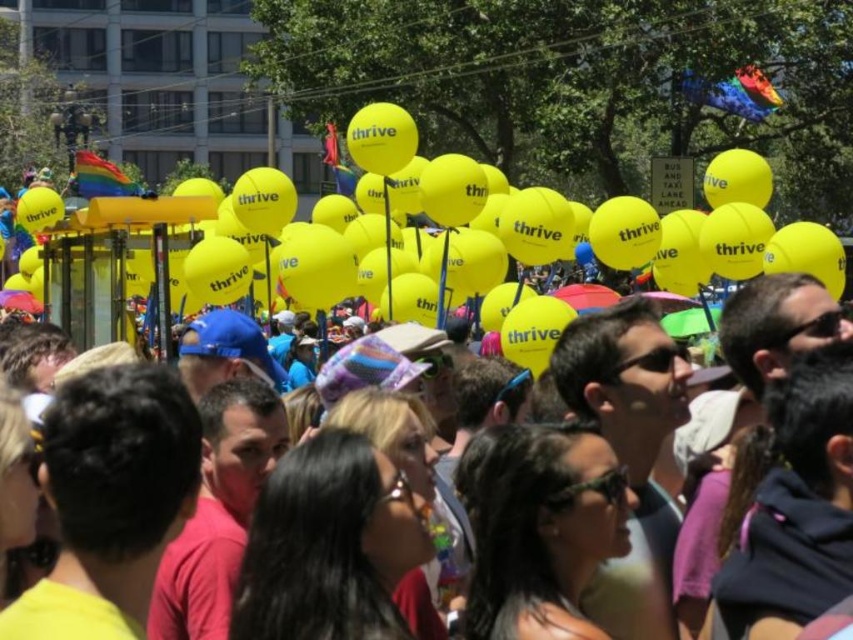
Is yellow matte balloon at upper center positioned behind yellow matte balloons at upper center?

Yes, yellow matte balloon at upper center is behind yellow matte balloons at upper center.

Is yellow matte balloon at upper center bigger than yellow matte balloons at upper center?

Yes, yellow matte balloon at upper center is bigger than yellow matte balloons at upper center.

Who is more forward, [654,244] or [15,419]?

Point [15,419]

Identify the location of yellow matte balloon at upper center. The height and width of the screenshot is (640, 853). (587, 237).